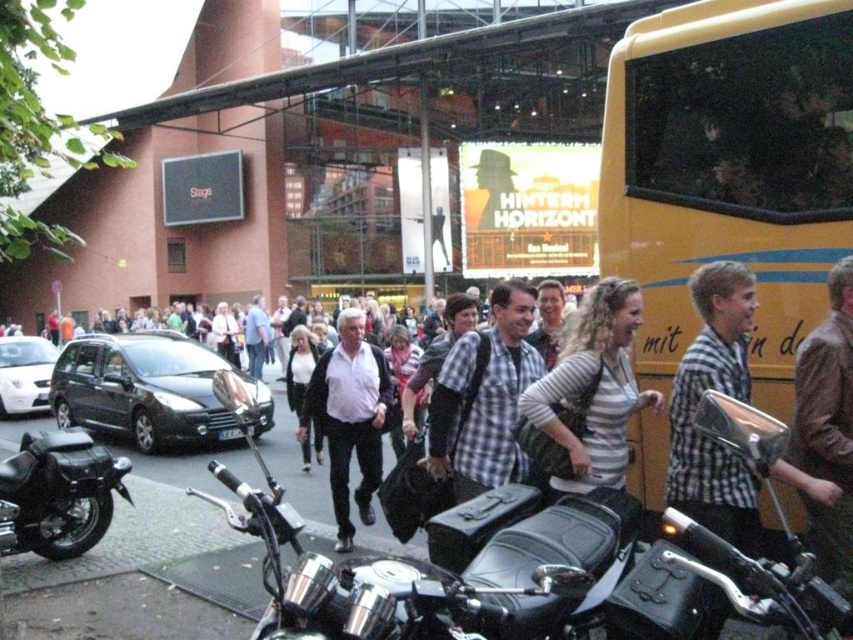
Question: Observing the image, what is the correct spatial positioning of black leather motorcycle at lower left in reference to white matte shirt at center?

Choices:
 (A) left
 (B) right

Answer: (A)

Question: Observing the image, what is the correct spatial positioning of checkered fabric shirt at center in reference to white matte shirt at center?

Choices:
 (A) above
 (B) below

Answer: (A)

Question: Among these objects, which one is farthest from the camera?

Choices:
 (A) shiny chrome motorcycle at center
 (B) white matte shirt at center
 (C) black leather motorcycle at lower left

Answer: (B)

Question: Which object is the closest to the yellow matte/decorative bus at right?

Choices:
 (A) white matte shirt at center
 (B) shiny chrome handlebars at center
 (C) shiny chrome motorcycle at center
 (D) black leather motorcycle at lower left

Answer: (B)

Question: From the image, what is the correct spatial relationship of shiny chrome handlebars at center in relation to checkered fabric shirt at center?

Choices:
 (A) above
 (B) below

Answer: (B)

Question: Among these points, which one is farthest from the camera?

Choices:
 (A) (821, 241)
 (B) (553, 493)
 (C) (26, 456)
 (D) (271, 586)

Answer: (C)